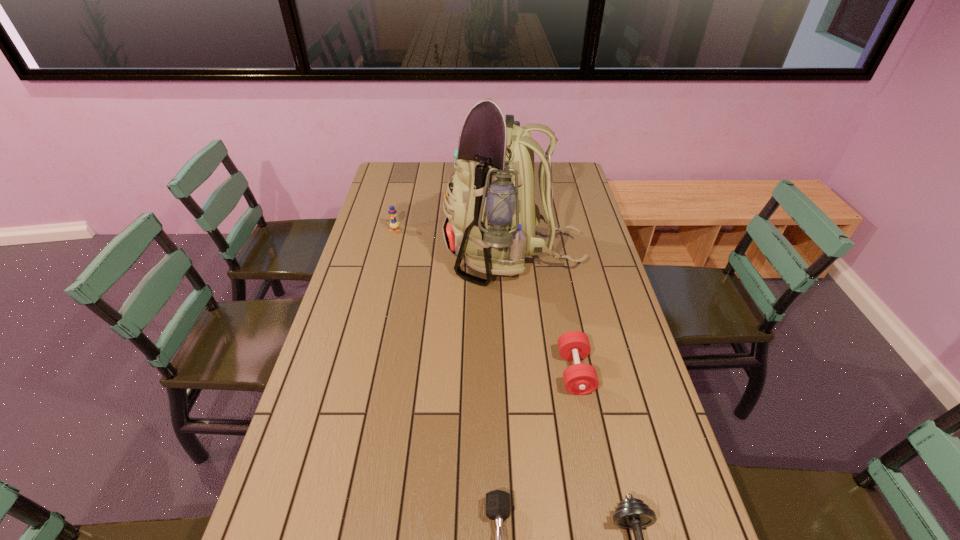
Locate an element on the screen. Image resolution: width=960 pixels, height=540 pixels. the tallest object is located at coordinates (491, 215).

Locate an element on the screen. Image resolution: width=960 pixels, height=540 pixels. duckling is located at coordinates (394, 224).

This screenshot has height=540, width=960. Find the location of `the second tallest object`. the second tallest object is located at coordinates tap(394, 224).

Where is `the farthest dumbbell`? The width and height of the screenshot is (960, 540). the farthest dumbbell is located at coordinates (579, 379).

Where is `vacant area located on the front-facing side of the backpack`? vacant area located on the front-facing side of the backpack is located at coordinates tap(422, 255).

In order to click on free space located 0.130m on the front-facing side of the backpack in this screenshot , I will do `click(408, 255)`.

The width and height of the screenshot is (960, 540). Identify the location of free region located 0.200m on the front-facing side of the backpack. (389, 255).

Locate an element on the screen. vacant space positioned 0.210m on the face of the duckling, where the monocle is placed is located at coordinates (385, 268).

Identify the location of vacant position located 0.250m on the left of the farthest dumbbell. The height and width of the screenshot is (540, 960). click(x=468, y=372).

At what (x,y) coordinates should I click in order to perform the action: click on object at the left edge. Please return your answer as a coordinate pair (x, y). This screenshot has height=540, width=960. Looking at the image, I should click on (394, 224).